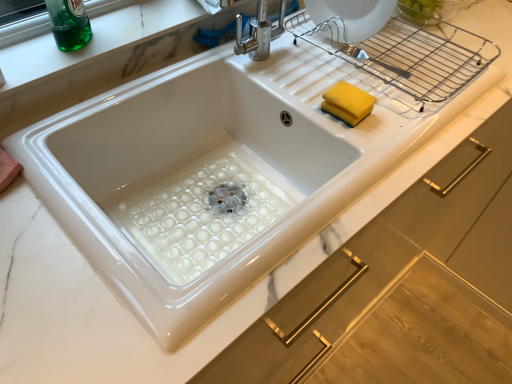
The height and width of the screenshot is (384, 512). In order to click on free location to the right of green glass bottle at upper left in this screenshot , I will do `click(131, 30)`.